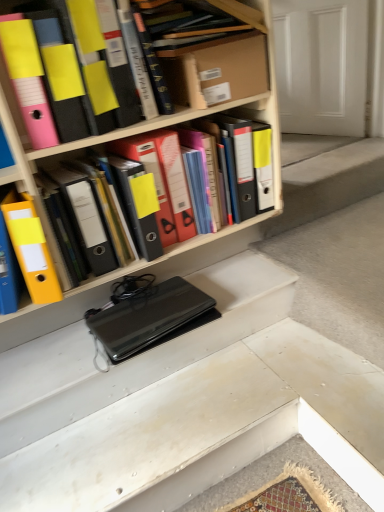
Question: Should I look upward or downward to see matte black binder at upper left, which is the 3th book from right to left?

Choices:
 (A) up
 (B) down

Answer: (A)

Question: Is cardboard box at upper center shorter than black matte laptop at center?

Choices:
 (A) no
 (B) yes

Answer: (A)

Question: Is cardboard box at upper center closer to camera compared to black matte laptop at center?

Choices:
 (A) no
 (B) yes

Answer: (B)

Question: Is cardboard box at upper center smaller than black matte laptop at center?

Choices:
 (A) no
 (B) yes

Answer: (A)

Question: Could you tell me if cardboard box at upper center is turned towards black matte laptop at center?

Choices:
 (A) yes
 (B) no

Answer: (B)

Question: Can you confirm if cardboard box at upper center is wider than black matte laptop at center?

Choices:
 (A) yes
 (B) no

Answer: (B)

Question: Is cardboard box at upper center completely or partially outside of black matte laptop at center?

Choices:
 (A) no
 (B) yes

Answer: (B)

Question: From a real-world perspective, is matte black binder at upper left, arranged as the first book when viewed from the left, over wooden book at upper center, the third book positioned from the left?

Choices:
 (A) no
 (B) yes

Answer: (A)

Question: From a real-world perspective, is matte black binder at upper left, which is the 3th book from right to left, physically below wooden book at upper center, which appears as the 1th book when viewed from the right?

Choices:
 (A) yes
 (B) no

Answer: (A)

Question: From the image's perspective, does matte black binder at upper left, arranged as the first book when viewed from the left, appear lower than wooden book at upper center, the third book positioned from the left?

Choices:
 (A) yes
 (B) no

Answer: (A)

Question: Is matte black binder at upper left, which is the 3th book from right to left, directly adjacent to wooden book at upper center, the third book positioned from the left?

Choices:
 (A) no
 (B) yes

Answer: (B)

Question: Does matte black binder at upper left, arranged as the first book when viewed from the left, have a greater width compared to wooden book at upper center, which appears as the 1th book when viewed from the right?

Choices:
 (A) no
 (B) yes

Answer: (A)

Question: Considering the relative sizes of matte black binder at upper left, which is the 3th book from right to left, and wooden book at upper center, which appears as the 1th book when viewed from the right, in the image provided, is matte black binder at upper left, which is the 3th book from right to left, bigger than wooden book at upper center, which appears as the 1th book when viewed from the right,?

Choices:
 (A) no
 (B) yes

Answer: (B)

Question: Would you consider white matte door at upper right to be distant from cardboard box at upper center?

Choices:
 (A) no
 (B) yes

Answer: (B)